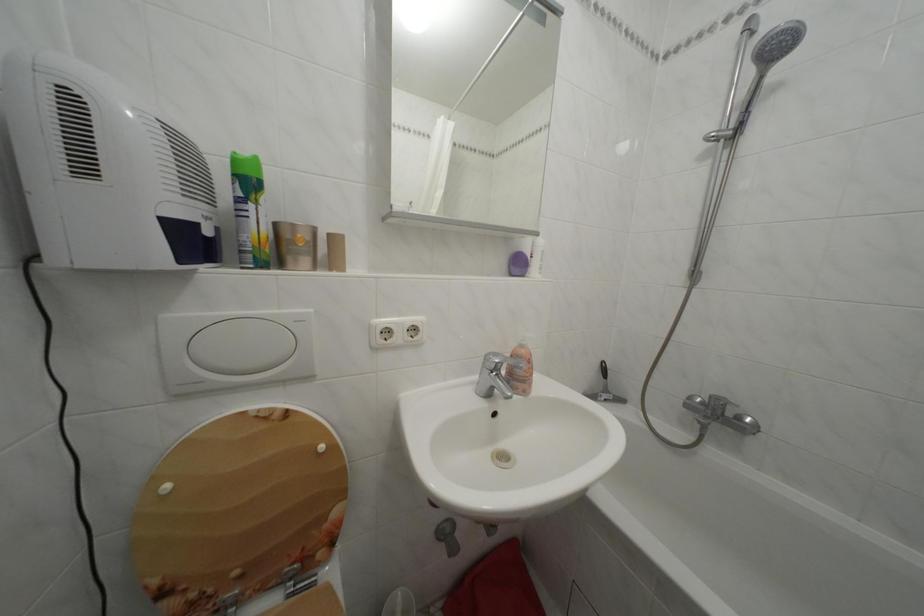
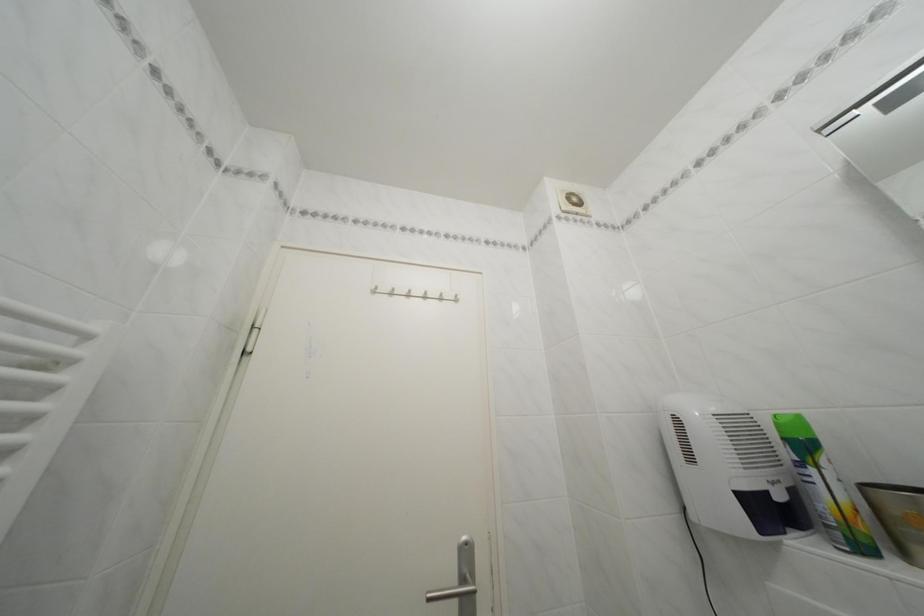
Locate, in the second image, the point that corresponds to the point at 92,172 in the first image.

(699, 464)